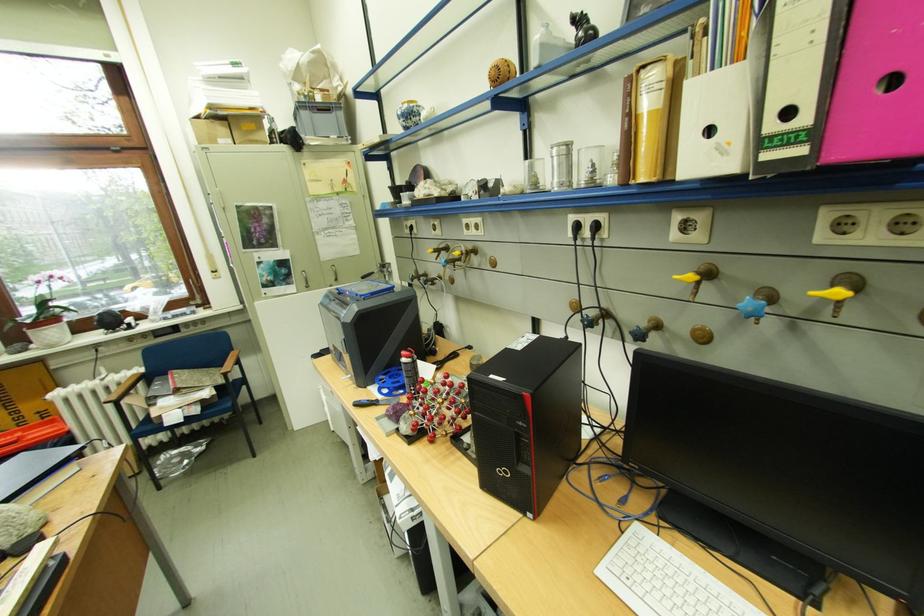
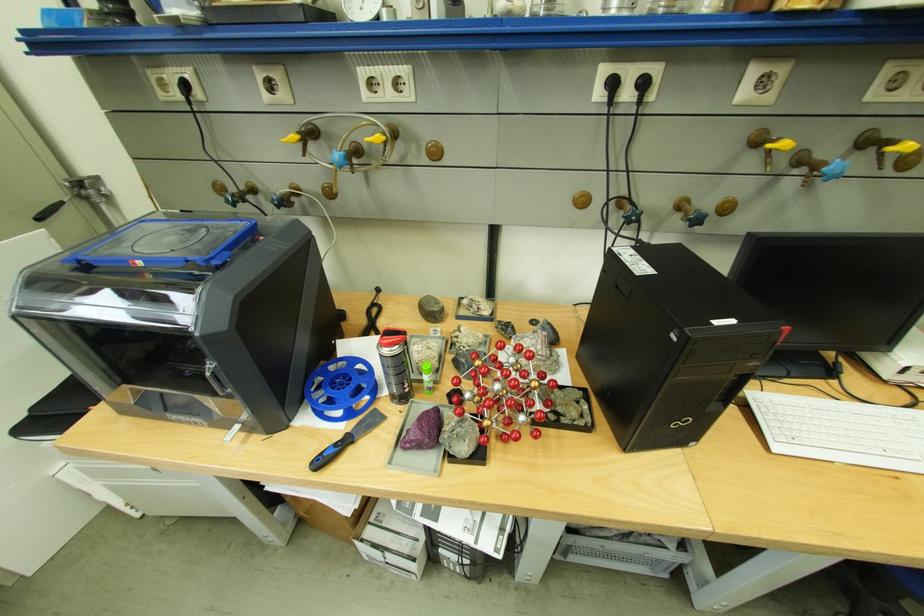
In the second image, find the point that corresponds to pixel 597 233 in the first image.

(638, 95)